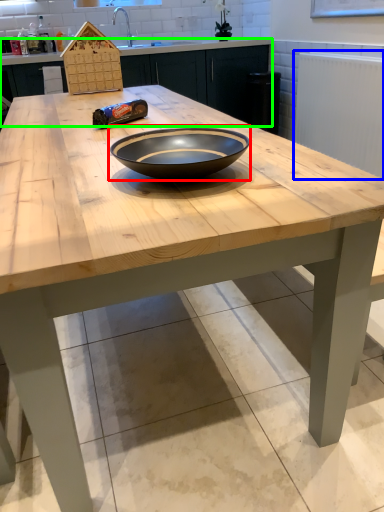
Question: Based on their relative distances, which object is nearer to bowl (highlighted by a red box)? Choose from radiator (highlighted by a blue box) and cabinetry (highlighted by a green box).

Choices:
 (A) radiator
 (B) cabinetry

Answer: (A)